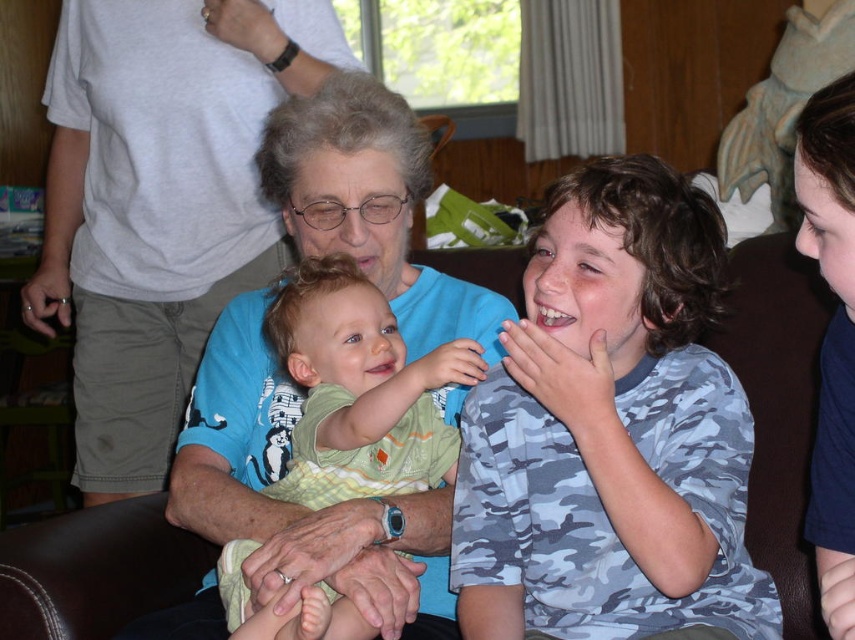
In the scene shown: In the scene, there are two shirts visible at the center of the image. The first is a light blue shirt at center, and the second is a green cotton shirt at center. Which of these shirts is positioned higher up in the image?

The light blue shirt at center is located above the green cotton shirt at center, so it is positioned higher up in the image.

Consider the image. You are a photographer taking a picture of the family. You notice the light blue shirt at center and the green cotton shirt at center. Which shirt is closer to the camera?

The light blue shirt at center is closer to the camera because the green cotton shirt at center is behind it.

You are standing at the point labeled as point (124, 237) and want to move to the point labeled as point (610, 422). Which direction should you move to reach your destination?

To move from point (124, 237) to point (610, 422), you should move forward since point (610, 422) is in front of point (124, 237).